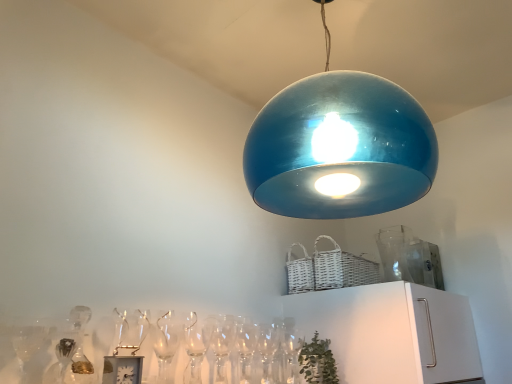
At what (x,y) coordinates should I click in order to perform the action: click on white wicker basket at upper right. Please return your answer as a coordinate pair (x, y). This screenshot has width=512, height=384. Looking at the image, I should click on (329, 269).

Where is `white wicker basket at upper right`? white wicker basket at upper right is located at coordinates (329, 269).

Where is `lamp above the white wicker basket at upper right (from the image's perspective)`? lamp above the white wicker basket at upper right (from the image's perspective) is located at coordinates (340, 148).

Could you tell me if white wicker basket at upper right is facing glossy blue dome at upper center?

No, white wicker basket at upper right is not aimed at glossy blue dome at upper center.

Is point (326, 270) closer or farther from the camera than point (377, 94)?

Clearly, point (326, 270) is more distant from the camera than point (377, 94).

Between white wicker basket at upper right and glossy blue dome at upper center, which one has larger width?

Wider between the two is glossy blue dome at upper center.

Based on the photo, which of these two, clear glass wine glass at lower center or glossy blue dome at upper center, stands shorter?

clear glass wine glass at lower center.

Is clear glass wine glass at lower center placed right next to glossy blue dome at upper center?

No, clear glass wine glass at lower center is not in contact with glossy blue dome at upper center.

Is point (185, 332) farther from camera compared to point (385, 104)?

Yes, it is.

The width and height of the screenshot is (512, 384). Find the location of `wine glass that appears on the left of glossy blue dome at upper center`. wine glass that appears on the left of glossy blue dome at upper center is located at coordinates (197, 347).

In the image, is clear glass wine glass at lower center on the left side or the right side of white wicker basket at upper right?

Clearly, clear glass wine glass at lower center is on the left of white wicker basket at upper right in the image.

Locate an element on the screen. This screenshot has width=512, height=384. basket above the clear glass wine glass at lower center (from the image's perspective) is located at coordinates (329, 269).

Can you confirm if clear glass wine glass at lower center is taller than white wicker basket at upper right?

Yes.

From the image's perspective, does clear glass wine glass at lower center appear lower than white wicker basket at upper right?

Yes, from the image's perspective, clear glass wine glass at lower center is beneath white wicker basket at upper right.

In the scene shown: From the image's perspective, between green leafy plant at lower center and glossy blue dome at upper center, who is located below?

green leafy plant at lower center, from the image's perspective.

Locate an element on the screen. The height and width of the screenshot is (384, 512). lamp that appears in front of the green leafy plant at lower center is located at coordinates (340, 148).

How much distance is there between green leafy plant at lower center and glossy blue dome at upper center?

They are 27.31 inches apart.

Considering the relative sizes of green leafy plant at lower center and glossy blue dome at upper center in the image provided, is green leafy plant at lower center wider than glossy blue dome at upper center?

In fact, green leafy plant at lower center might be narrower than glossy blue dome at upper center.

Is green leafy plant at lower center completely or partially outside of clear glass wine glass at lower center?

Yes, green leafy plant at lower center is outside of clear glass wine glass at lower center.

Looking at this image, which is more to the left, green leafy plant at lower center or clear glass wine glass at lower center?

clear glass wine glass at lower center.

Can you confirm if green leafy plant at lower center is smaller than clear glass wine glass at lower center?

No, green leafy plant at lower center is not smaller than clear glass wine glass at lower center.

Can you tell me how much green leafy plant at lower center and clear glass wine glass at lower center differ in facing direction?

6.82 degrees separate the facing orientations of green leafy plant at lower center and clear glass wine glass at lower center.

Does glossy blue dome at upper center appear on the right side of white wicker basket at upper right?

No.

Looking at this image, between glossy blue dome at upper center and white wicker basket at upper right, which one is positioned behind?

Positioned behind is white wicker basket at upper right.

Is glossy blue dome at upper center placed right next to white wicker basket at upper right?

No, glossy blue dome at upper center is not with white wicker basket at upper right.

Is white wicker basket at upper right not within clear glass wine glass at lower center?

Yes, white wicker basket at upper right is outside of clear glass wine glass at lower center.

Find the location of a particular element. basket that is above the clear glass wine glass at lower center (from the image's perspective) is located at coordinates (329, 269).

Locate an element on the screen. lamp above the white wicker basket at upper right (from a real-world perspective) is located at coordinates click(x=340, y=148).

Find the location of `lamp in front of the clear glass wine glass at lower center`. lamp in front of the clear glass wine glass at lower center is located at coordinates (340, 148).

From the picture: Which object lies nearer to the anchor point white wicker basket at upper right, green leafy plant at lower center or clear glass wine glass at lower center?

Based on the image, green leafy plant at lower center appears to be nearer to white wicker basket at upper right.

Looking at the image, which one is located closer to glossy blue dome at upper center, white wicker basket at upper right or clear glass wine glass at lower center?

Among the two, white wicker basket at upper right is located nearer to glossy blue dome at upper center.

Considering their positions, is glossy blue dome at upper center positioned further to green leafy plant at lower center than white wicker basket at upper right?

The object further to green leafy plant at lower center is glossy blue dome at upper center.

Based on the photo, which object lies further to the anchor point clear glass wine glass at lower center, glossy blue dome at upper center or white wicker basket at upper right?

Based on the image, glossy blue dome at upper center appears to be further to clear glass wine glass at lower center.

Based on their spatial positions, is glossy blue dome at upper center or clear glass wine glass at lower center further from green leafy plant at lower center?

glossy blue dome at upper center lies further to green leafy plant at lower center than the other object.

Based on their spatial positions, is clear glass wine glass at lower center or glossy blue dome at upper center closer to green leafy plant at lower center?

clear glass wine glass at lower center.

Which object lies nearer to the anchor point clear glass wine glass at lower center, glossy blue dome at upper center or green leafy plant at lower center?

green leafy plant at lower center is closer to clear glass wine glass at lower center.

From the image, which object appears to be nearer to clear glass wine glass at lower center, white wicker basket at upper right or glossy blue dome at upper center?

white wicker basket at upper right is closer to clear glass wine glass at lower center.

This screenshot has width=512, height=384. What are the coordinates of `wine glass between glossy blue dome at upper center and green leafy plant at lower center in the vertical direction` in the screenshot? It's located at (197, 347).

This screenshot has height=384, width=512. I want to click on basket between glossy blue dome at upper center and clear glass wine glass at lower center from top to bottom, so click(329, 269).

This screenshot has width=512, height=384. Identify the location of basket between glossy blue dome at upper center and green leafy plant at lower center in the vertical direction. (329, 269).

The width and height of the screenshot is (512, 384). Find the location of `plant between clear glass wine glass at lower center and white wicker basket at upper right in the horizontal direction`. plant between clear glass wine glass at lower center and white wicker basket at upper right in the horizontal direction is located at coordinates pyautogui.click(x=318, y=362).